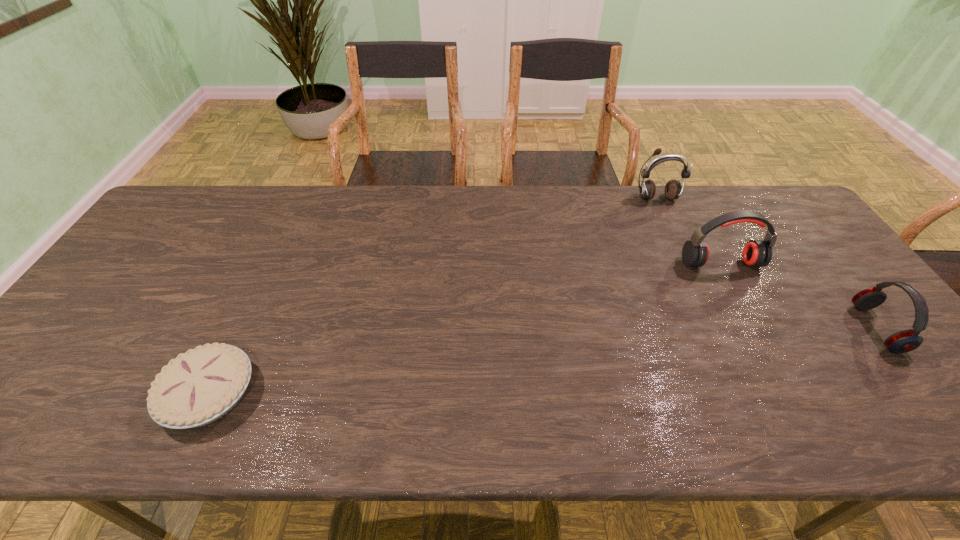
The image size is (960, 540). I want to click on the farthest earphone, so click(x=673, y=189).

I want to click on the second nearest earphone, so click(x=757, y=253).

Find the location of a particular element. the third tallest object is located at coordinates (904, 341).

Locate an element on the screen. This screenshot has width=960, height=540. the rightmost object is located at coordinates (904, 341).

Where is `the leftmost object`? the leftmost object is located at coordinates (200, 386).

Identify the location of the shortest object. Image resolution: width=960 pixels, height=540 pixels. coord(200,386).

This screenshot has width=960, height=540. Identify the location of vacant area located 0.250m on the ear pads of the farthest object. (684, 257).

Image resolution: width=960 pixels, height=540 pixels. I want to click on free space located on the ear cups of the second farthest object, so click(x=738, y=296).

Identify the location of free space located 0.210m on the ear cups of the shortest earphone. (779, 329).

Where is `vacant space situated on the ear cups of the shortest earphone`? vacant space situated on the ear cups of the shortest earphone is located at coordinates (779, 329).